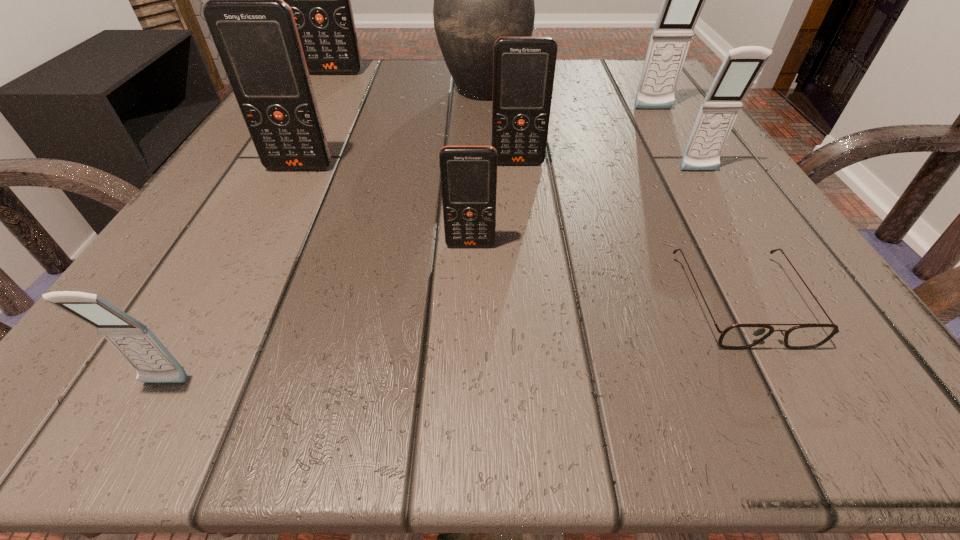
Where is `the nearest cellular telephone`? the nearest cellular telephone is located at coordinates (133, 340).

Locate an element on the screen. This screenshot has height=540, width=960. the nearest object is located at coordinates click(x=133, y=340).

Locate an element on the screen. This screenshot has width=960, height=540. the eighth farthest object is located at coordinates (738, 336).

Locate an element on the screen. the shortest object is located at coordinates (738, 336).

This screenshot has width=960, height=540. Identify the location of free spot located 0.190m on the screen of the biggest orange cellular telephone. (307, 120).

The height and width of the screenshot is (540, 960). Identify the location of vacant point located 0.280m on the front-facing side of the farthest gray cellular telephone. (713, 210).

Locate an element on the screen. The height and width of the screenshot is (540, 960). vacant region located 0.120m on the screen of the second biggest orange cellular telephone is located at coordinates (271, 224).

At what (x,y) coordinates should I click in order to perform the action: click on vacant space located 0.240m on the front-facing side of the second nearest gray cellular telephone. Please return your answer as a coordinate pair (x, y). Looking at the image, I should click on (778, 298).

In order to click on vacant space located on the screen of the second smallest orange cellular telephone in this screenshot , I will do `click(538, 340)`.

At what (x,y) coordinates should I click in order to perform the action: click on vacant area located 0.140m on the screen of the sixth farthest cellular telephone. Please return your answer as a coordinate pair (x, y). Looking at the image, I should click on (468, 343).